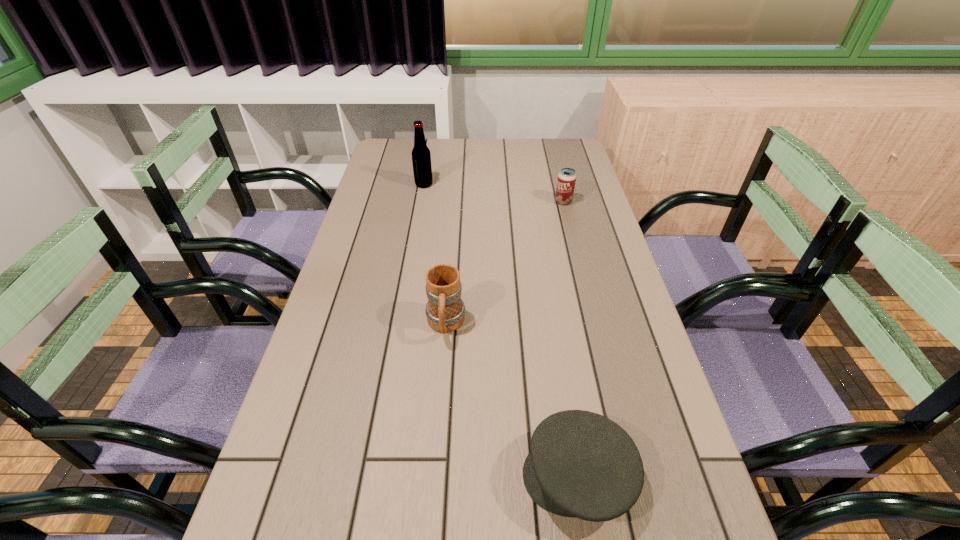
Locate an element on the screen. the leftmost object is located at coordinates (421, 158).

Identify the location of the tallest object. (421, 158).

Locate an element on the screen. the second object from left to right is located at coordinates (445, 310).

This screenshot has height=540, width=960. In order to click on the second nearest object in this screenshot , I will do `click(445, 310)`.

The image size is (960, 540). I want to click on the second farthest object, so click(566, 180).

Locate an element on the screen. the second shortest object is located at coordinates tap(566, 180).

Locate an element on the screen. The width and height of the screenshot is (960, 540). beret is located at coordinates (581, 464).

You are a GUI agent. You are given a task and a screenshot of the screen. Output one action in this format:
    pyautogui.click(x=<x>, y=<y>)
    Task: Click on the shortest object
    
    Given the screenshot: What is the action you would take?
    pyautogui.click(x=581, y=464)

Identify the location of vacant area situated on the right of the beer bottle. (472, 185).

I want to click on vacant space located 0.360m on the side of the third shortest object with the handle, so click(x=432, y=511).